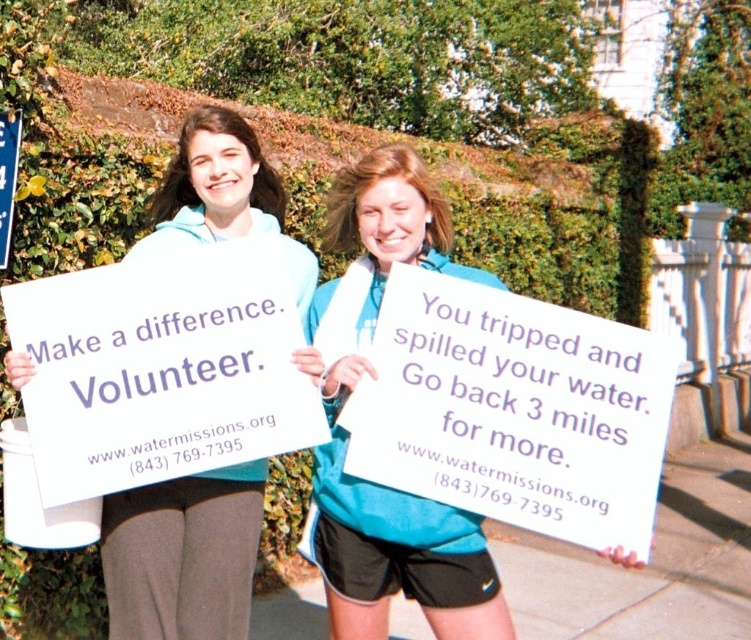
Is white paper sign at center above matte blue sweatshirt at center?

Actually, white paper sign at center is below matte blue sweatshirt at center.

Which is above, white paper sign at center or matte blue sweatshirt at center?

matte blue sweatshirt at center

The height and width of the screenshot is (640, 751). What do you see at coordinates (397, 556) in the screenshot?
I see `white paper sign at center` at bounding box center [397, 556].

This screenshot has width=751, height=640. I want to click on white paper sign at center, so click(397, 556).

Does white paper sign at center appear on the right side of blue plastic sign at upper left?

Yes, white paper sign at center is to the right of blue plastic sign at upper left.

Does white paper sign at center have a lesser width compared to blue plastic sign at upper left?

Incorrect, white paper sign at center's width is not less than blue plastic sign at upper left's.

Where is `white paper sign at center`? This screenshot has width=751, height=640. white paper sign at center is located at coordinates (397, 556).

You are a GUI agent. You are given a task and a screenshot of the screen. Output one action in this format:
    pyautogui.click(x=<x>, y=<y>)
    Task: Click on the white paper sign at center
    The height and width of the screenshot is (640, 751).
    Given the screenshot: What is the action you would take?
    pyautogui.click(x=397, y=556)

Is point (160, 609) closer to camera compared to point (8, 220)?

Yes.

Image resolution: width=751 pixels, height=640 pixels. What are the coordinates of `matte blue sweatshirt at center` in the screenshot? It's located at (182, 556).